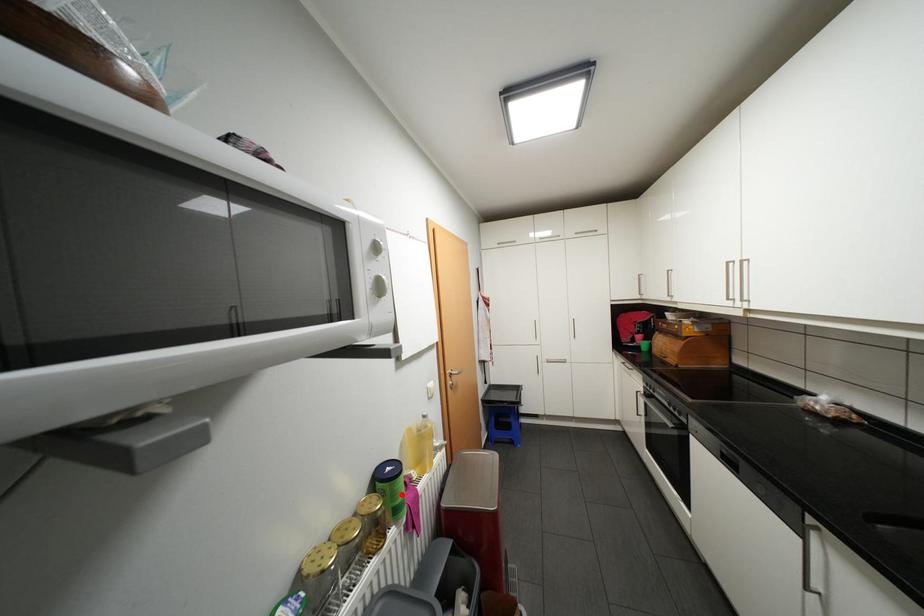
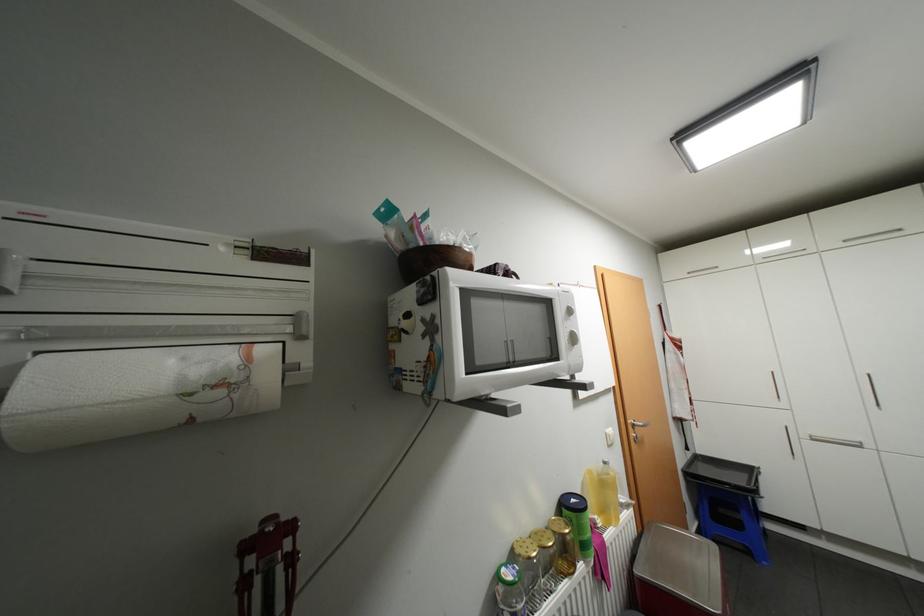
Question: I am providing you with two images of the same scene from different viewpoints. Image1 has a red point marked. In image2, the corresponding 3D location appears at what relative position? Reply with the corresponding letter.

Choices:
 (A) Closer
 (B) Farther

Answer: (B)